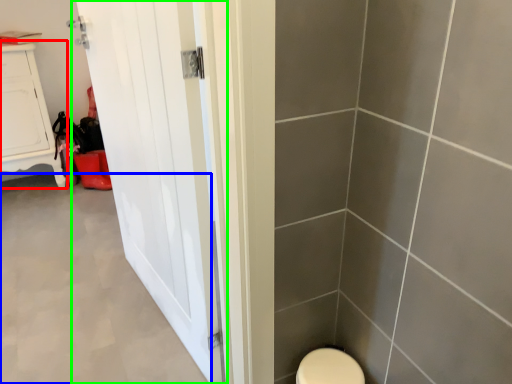
Question: Based on their relative distances, which object is farther from furniture (highlighted by a red box)? Choose from plain (highlighted by a blue box) and door (highlighted by a green box).

Choices:
 (A) plain
 (B) door

Answer: (B)